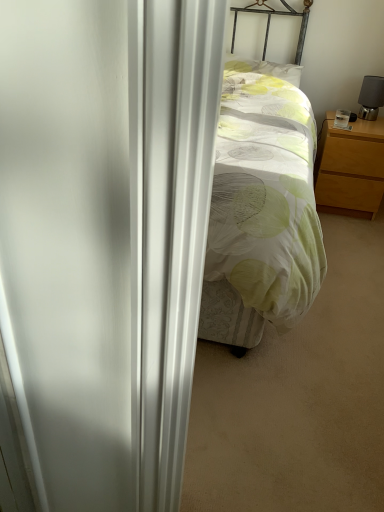
Locate an element on the screen. empty space that is ontop of light wood/finish nightstand at right (from a real-world perspective) is located at coordinates (359, 120).